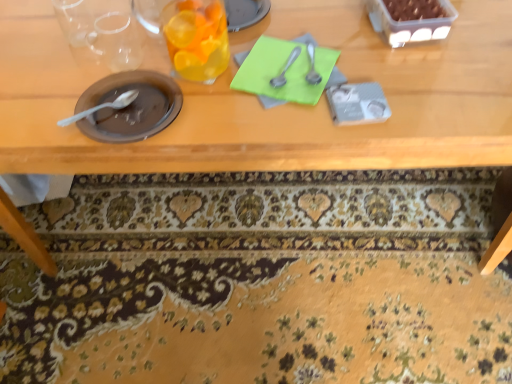
Find the location of a particular element. The height and width of the screenshot is (384, 512). vacant space behind satin silver spoon at center, which is the second tableware from right to left is located at coordinates (282, 29).